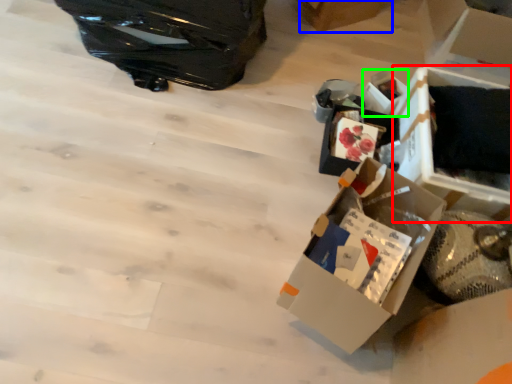
Question: Based on their relative distances, which object is farther from storage box (highlighted by a red box)? Choose from cardboard box (highlighted by a blue box) and storage box (highlighted by a green box).

Choices:
 (A) cardboard box
 (B) storage box

Answer: (A)